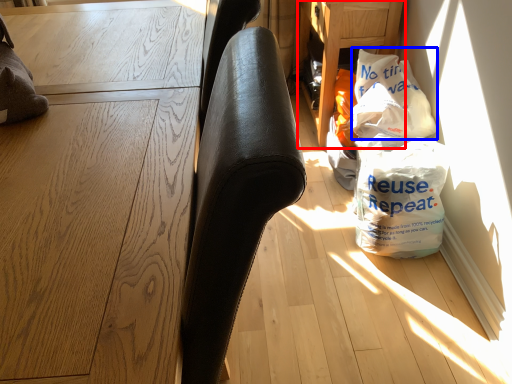
Question: Which object is further to the camera taking this photo, table (highlighted by a red box) or grocery bag (highlighted by a blue box)?

Choices:
 (A) table
 (B) grocery bag

Answer: (A)